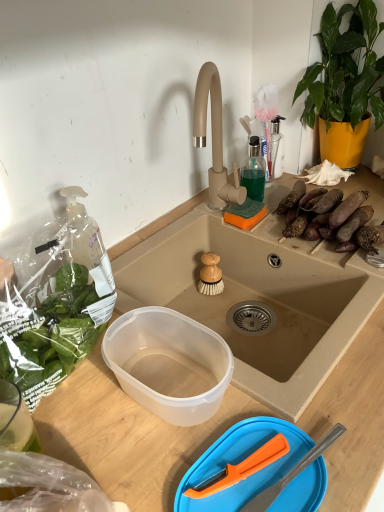
Question: From the image's perspective, relative to brown rough sweet potatoes at right, is transparent plastic bowl at lower center above or below?

Choices:
 (A) below
 (B) above

Answer: (A)

Question: From a real-world perspective, is transparent plastic bowl at lower center above or below brown rough sweet potatoes at right?

Choices:
 (A) above
 (B) below

Answer: (B)

Question: Which is farther from the green leafy plant at upper right?

Choices:
 (A) brown rough sweet potatoes at right
 (B) wooden-bristled brush at sink center
 (C) translucent glass bottle at upper center
 (D) transparent plastic container at center
 (E) transparent plastic bowl at lower center

Answer: (E)

Question: Which object is the closest to the transparent plastic container at center?

Choices:
 (A) transparent plastic bowl at lower center
 (B) brown rough sweet potatoes at right
 (C) wooden-bristled brush at sink center
 (D) translucent glass bottle at upper center
 (E) green leafy plant at upper right

Answer: (A)